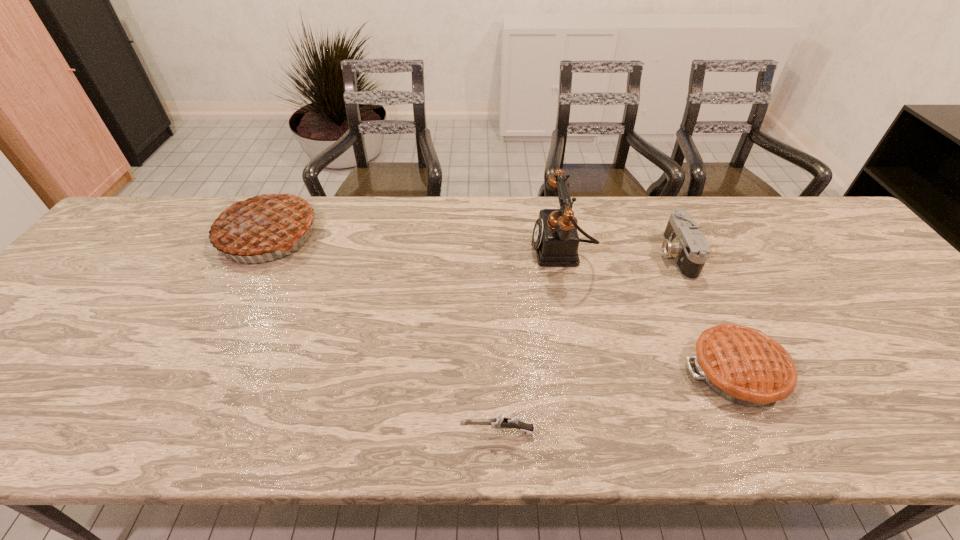
Find the location of a particular element. The height and width of the screenshot is (540, 960). telephone that is positioned at the far edge is located at coordinates pyautogui.click(x=556, y=240).

You are a GUI agent. You are given a task and a screenshot of the screen. Output one action in this format:
    pyautogui.click(x=<x>, y=<y>)
    Task: Click on the camera situated at the far edge
    The width and height of the screenshot is (960, 540).
    Given the screenshot: What is the action you would take?
    pyautogui.click(x=683, y=240)

This screenshot has width=960, height=540. In order to click on pie located at the near edge in this screenshot , I will do `click(743, 365)`.

The height and width of the screenshot is (540, 960). I want to click on gun situated at the near edge, so click(x=499, y=422).

The image size is (960, 540). What are the coordinates of `blank space at the far edge of the desktop` in the screenshot? It's located at (498, 225).

I want to click on vacant space at the near edge of the desktop, so click(x=532, y=420).

Where is `free region at the left edge`? Image resolution: width=960 pixels, height=540 pixels. free region at the left edge is located at coordinates (22, 350).

In the image, there is a desktop. Where is `vacant space at the right edge`? This screenshot has width=960, height=540. vacant space at the right edge is located at coordinates (937, 360).

This screenshot has width=960, height=540. In order to click on vacant space that is in between the gun and the telephone in this screenshot , I will do `click(529, 341)`.

You are a GUI agent. You are given a task and a screenshot of the screen. Output one action in this format:
    pyautogui.click(x=<x>, y=<y>)
    Task: Click on the unoccupied area between the telephone and the camera
    The width and height of the screenshot is (960, 540).
    Given the screenshot: What is the action you would take?
    pyautogui.click(x=618, y=252)